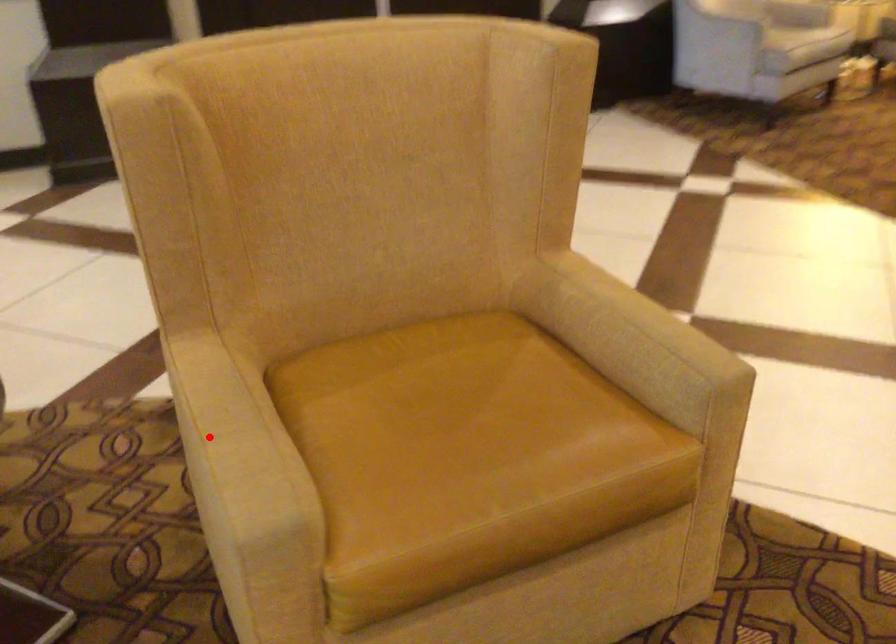
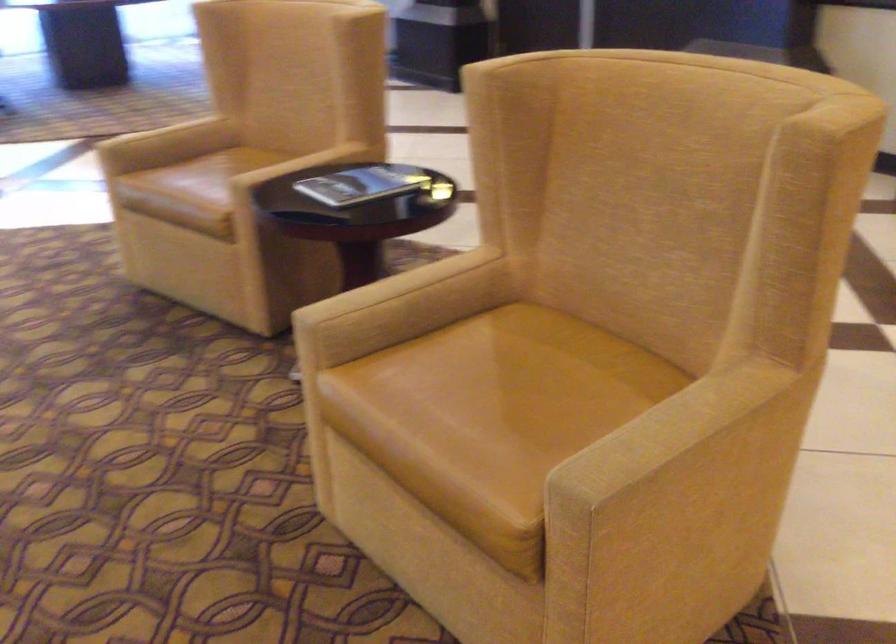
Find the pixel in the second image that matches the highlighted location in the first image.

(394, 286)